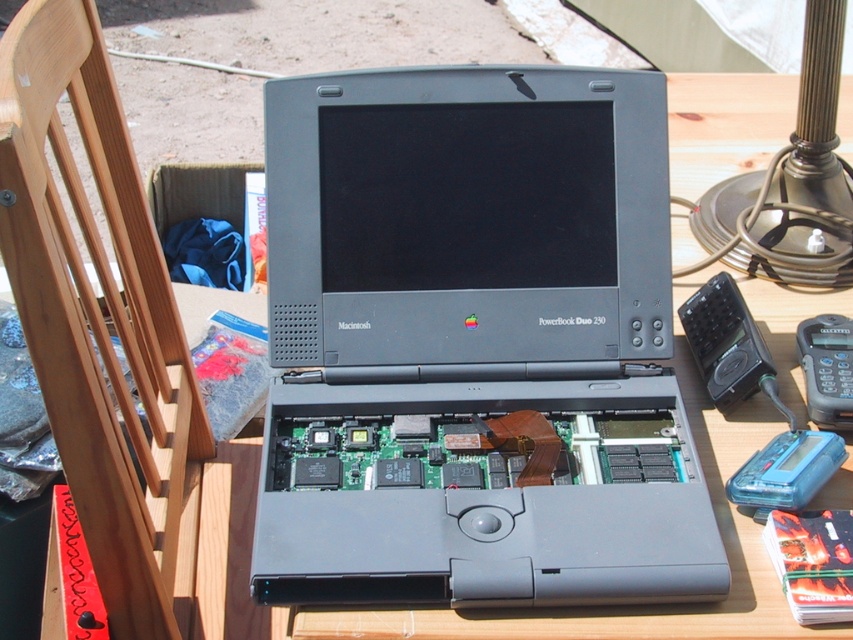
Between wooden at left and polished brass lamp at upper right, which one appears on the right side from the viewer's perspective?

From the viewer's perspective, polished brass lamp at upper right appears more on the right side.

Who is positioned more to the left, wooden at left or polished brass lamp at upper right?

Positioned to the left is wooden at left.

Is point (100, 182) positioned after point (689, 221)?

No, (100, 182) is closer to viewer.

At what (x,y) coordinates should I click in order to perform the action: click on wooden at left. Please return your answer as a coordinate pair (x, y). Image resolution: width=853 pixels, height=640 pixels. Looking at the image, I should click on (97, 312).

Does wooden at left have a greater width compared to black plastic phone at right?

Indeed, wooden at left has a greater width compared to black plastic phone at right.

Is wooden at left thinner than black plastic phone at right?

No.

Does point (32, 250) lie behind point (850, 422)?

No, it is in front of (850, 422).

Identify the location of wooden at left. This screenshot has height=640, width=853. (97, 312).

Can you confirm if polished brass lamp at upper right is smaller than black plastic phone at right?

No.

Between point (703, 228) and point (804, 333), which one is positioned in front?

Point (804, 333) is more forward.

Find the location of `polished brass lamp at upper right`. polished brass lamp at upper right is located at coordinates (791, 182).